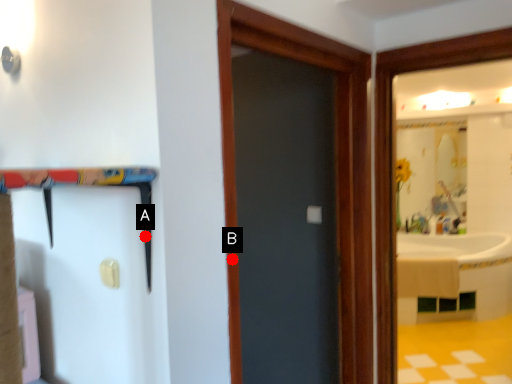
Question: Two points are circled on the image, labeled by A and B beside each circle. Which point is closer to the camera taking this photo?

Choices:
 (A) A is closer
 (B) B is closer

Answer: (A)